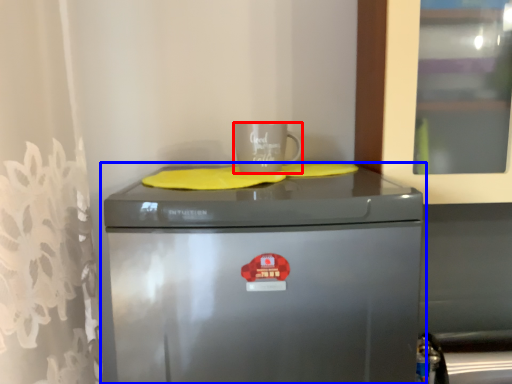
Question: Which object appears closest to the camera in this image, mug (highlighted by a red box) or home appliance (highlighted by a blue box)?

Choices:
 (A) mug
 (B) home appliance

Answer: (B)